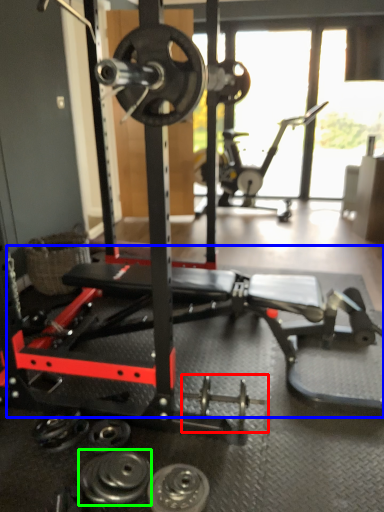
Question: Estimate the real-world distances between objects in this image. Which object is closer to dumbbell (highlighted by a red box), training bench (highlighted by a blue box) or dumbbell (highlighted by a green box)?

Choices:
 (A) training bench
 (B) dumbbell

Answer: (B)